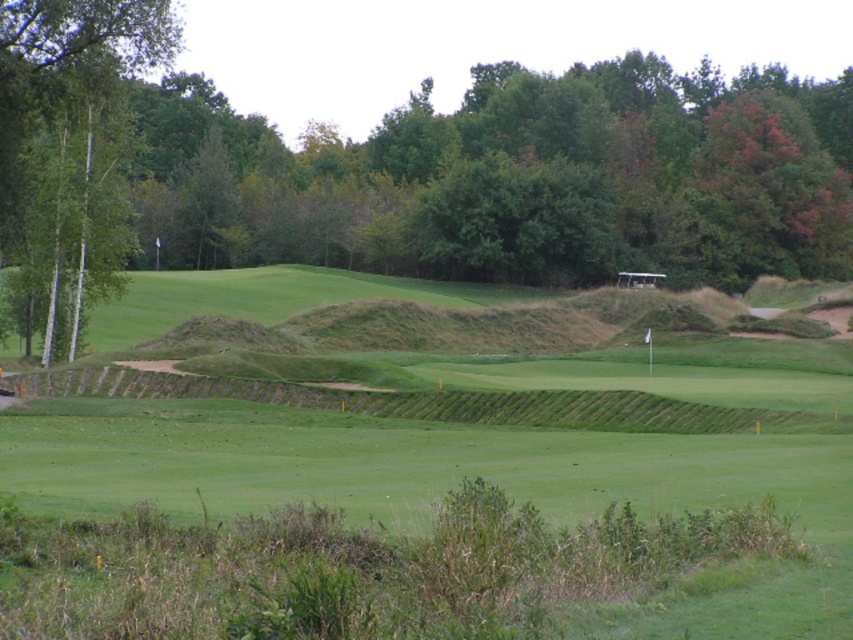
Which is more to the left, green leafy tree at center or green leafy tree at left?

green leafy tree at left is more to the left.

What do you see at coordinates (408, 170) in the screenshot? This screenshot has width=853, height=640. I see `green leafy tree at center` at bounding box center [408, 170].

Between point (61, 97) and point (12, 90), which one is positioned behind?

The point (61, 97) is behind.

The width and height of the screenshot is (853, 640). I want to click on green leafy tree at center, so click(408, 170).

Is green leafy tree at center in front of green grassy golf course at center?

No, it is behind green grassy golf course at center.

Measure the distance between green leafy tree at center and camera.

They are 45.20 meters apart.

Find the location of a particular element. The height and width of the screenshot is (640, 853). green leafy tree at center is located at coordinates (408, 170).

Looking at this image, is green grassy golf course at center wider than green leafy tree at left?

Indeed, green grassy golf course at center has a greater width compared to green leafy tree at left.

Is point (793, 595) closer to camera compared to point (144, 26)?

Yes, it is.

Between point (366, 484) and point (97, 20), which one is positioned in front?

Positioned in front is point (366, 484).

Identify the location of green grassy golf course at center. Image resolution: width=853 pixels, height=640 pixels. (479, 474).